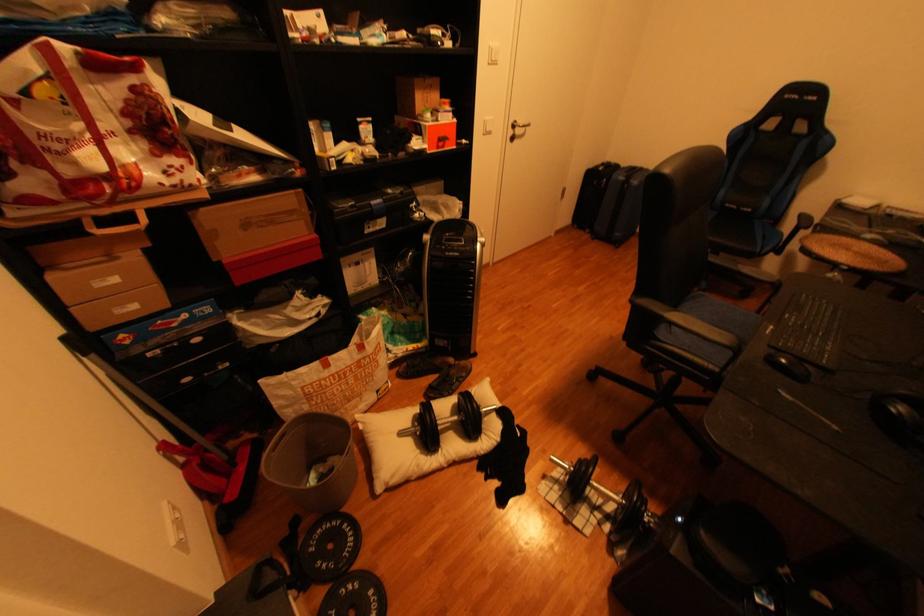
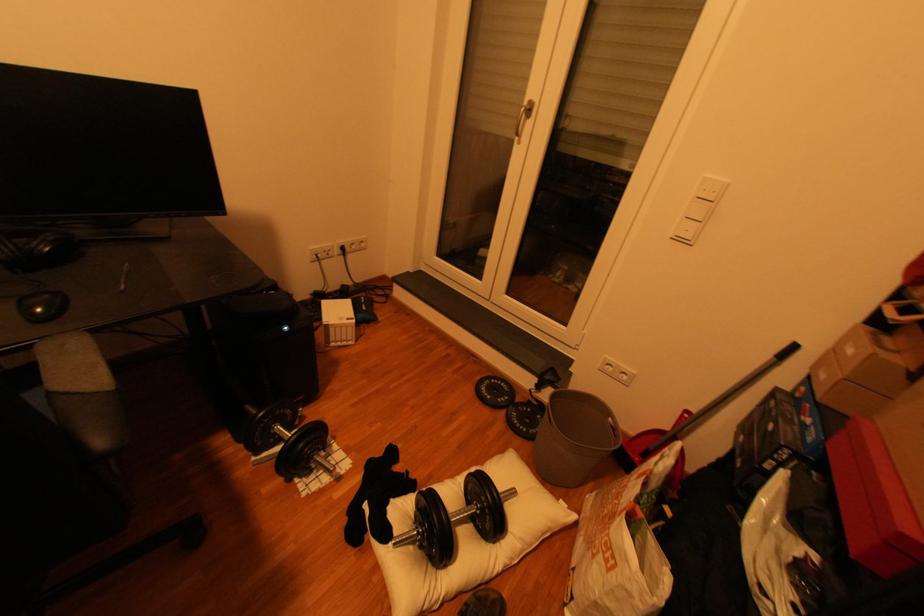
Where in the second image is the point corresponding to the point at 504,416 from the first image?

(406, 533)